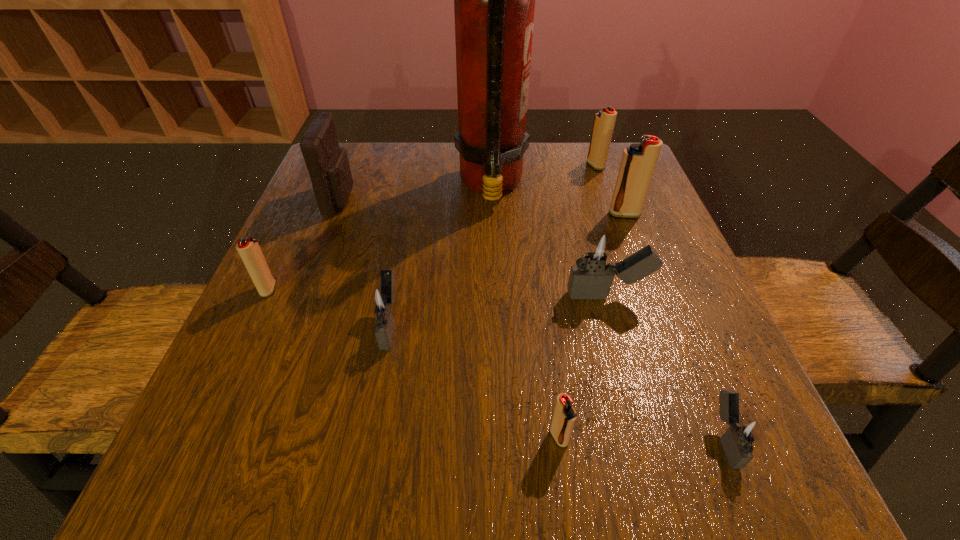
You are a GUI agent. You are given a task and a screenshot of the screen. Output one action in this format:
    pyautogui.click(x=<x>, y=<y>)
    Task: Click on the vacant position in the image that satisfies the following two spatial constraints: 1. at the nozzle of the tallest object; 2. on the left side of the smallest gray igniter
    The width and height of the screenshot is (960, 540).
    Given the screenshot: What is the action you would take?
    pyautogui.click(x=499, y=438)

This screenshot has height=540, width=960. In order to click on vacant space that satisfies the following two spatial constraints: 1. on the back side of the leftmost object; 2. on the left side of the farthest red igniter in this screenshot , I will do `click(326, 166)`.

Where is `vacant area in the image that satisfies the following two spatial constraints: 1. on the front side of the tallest igniter; 2. on the left side of the farthest igniter`? This screenshot has width=960, height=540. vacant area in the image that satisfies the following two spatial constraints: 1. on the front side of the tallest igniter; 2. on the left side of the farthest igniter is located at coordinates (612, 214).